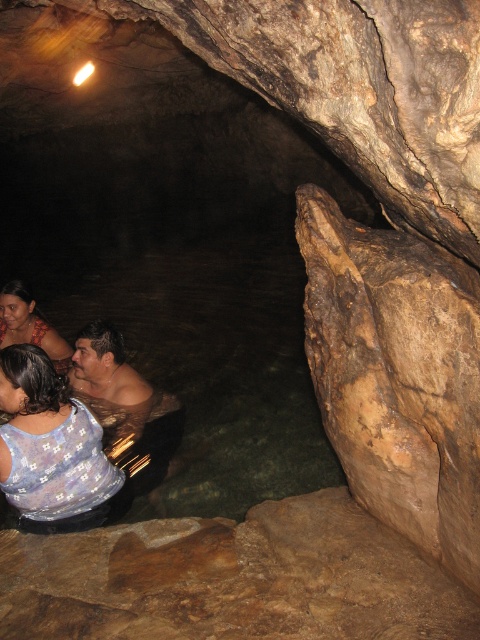
Question: Can you confirm if brown rough rock at lower center is positioned to the left of matte brown hair at lower left?

Choices:
 (A) yes
 (B) no

Answer: (B)

Question: Which of the following is the closest to the observer?

Choices:
 (A) printed fabric blouse at lower left
 (B) matte brown hair at lower left

Answer: (A)

Question: Estimate the real-world distances between objects in this image. Which object is farther from the brown rough rock at lower center?

Choices:
 (A) printed fabric blouse at lower left
 (B) matte brown hair at lower left

Answer: (B)

Question: Is printed fabric blouse at lower left positioned behind matte brown hair at lower left?

Choices:
 (A) yes
 (B) no

Answer: (B)

Question: Does brown rough rock at lower center appear on the right side of matte brown hair at lower left?

Choices:
 (A) no
 (B) yes

Answer: (B)

Question: Which point is closer to the camera?

Choices:
 (A) (74, 451)
 (B) (25, 294)
 (C) (120, 586)

Answer: (C)